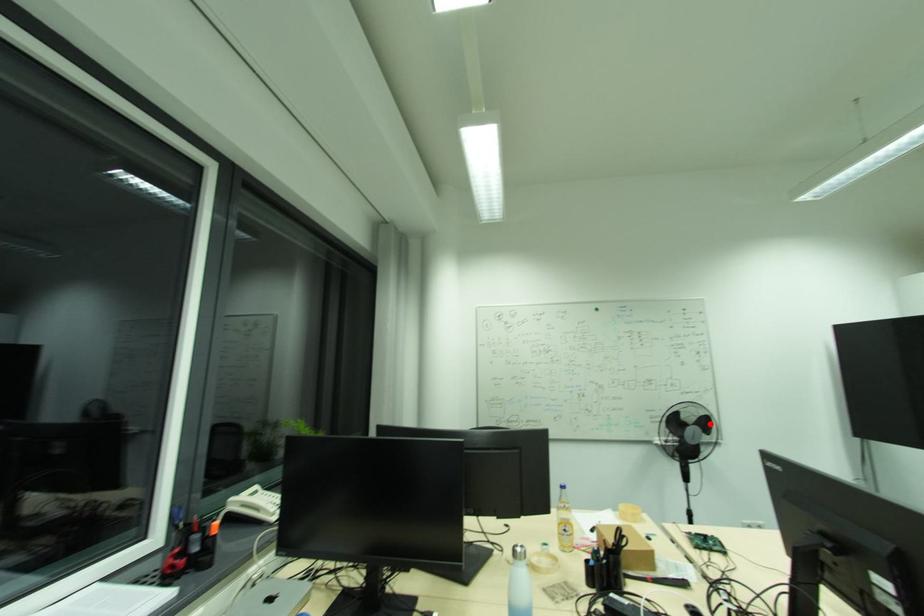
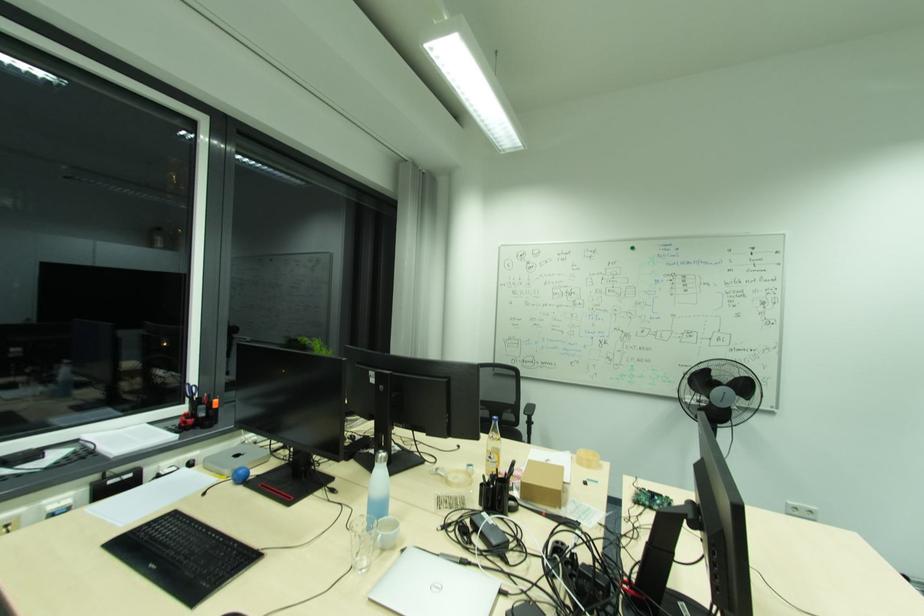
Find the pixel in the second image that matches the highlighted location in the first image.

(748, 387)